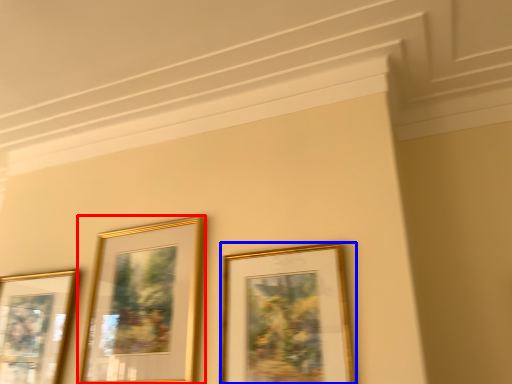
Question: Which object appears farthest to the camera in this image, picture frame (highlighted by a red box) or picture frame (highlighted by a blue box)?

Choices:
 (A) picture frame
 (B) picture frame

Answer: (A)